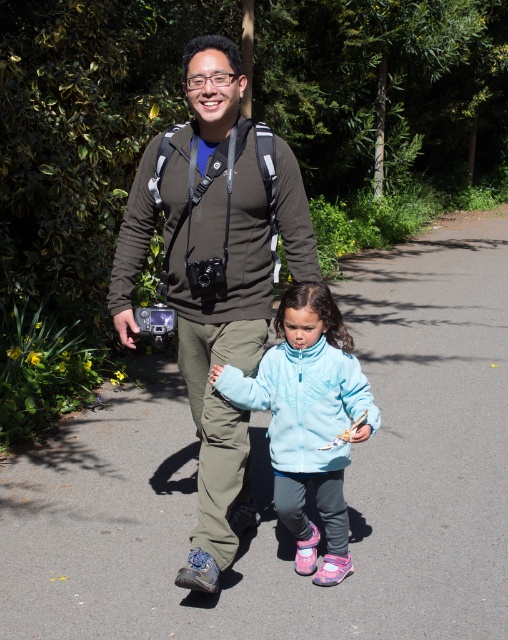
Question: Which point appears farthest from the camera in this image?

Choices:
 (A) (212, 572)
 (B) (312, 330)
 (C) (414, 364)

Answer: (C)

Question: Can you confirm if gray asphalt pavement at center is positioned to the left of light blue fleece jacket at center?

Choices:
 (A) no
 (B) yes

Answer: (A)

Question: Does gray asphalt pavement at center appear under light blue fleece jacket at center?

Choices:
 (A) no
 (B) yes

Answer: (A)

Question: Can you confirm if matte green jacket at center is positioned below light blue fleece jacket at center?

Choices:
 (A) no
 (B) yes

Answer: (A)

Question: Which point is farther from the camera taking this photo?

Choices:
 (A) (270, 356)
 (B) (165, 269)

Answer: (B)

Question: Which object is the closest to the matte green jacket at center?

Choices:
 (A) gray asphalt pavement at center
 (B) light blue fleece jacket at center

Answer: (B)